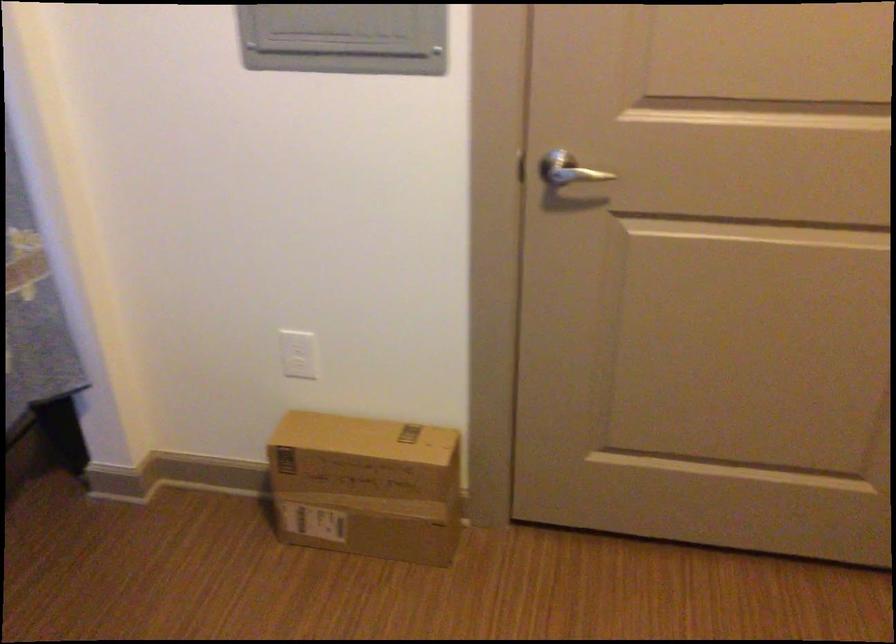
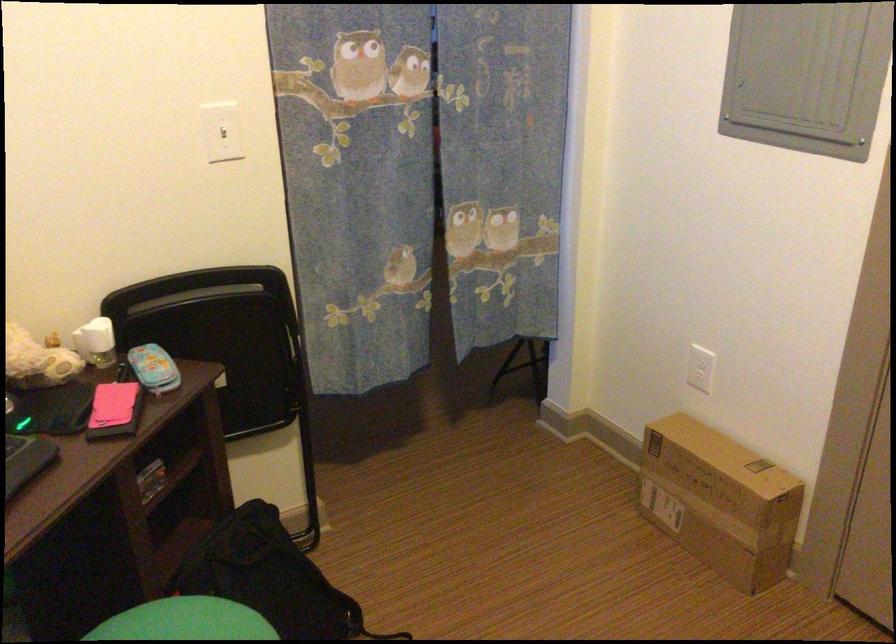
The point at (297, 364) is marked in the first image. Where is the corresponding point in the second image?

(700, 368)